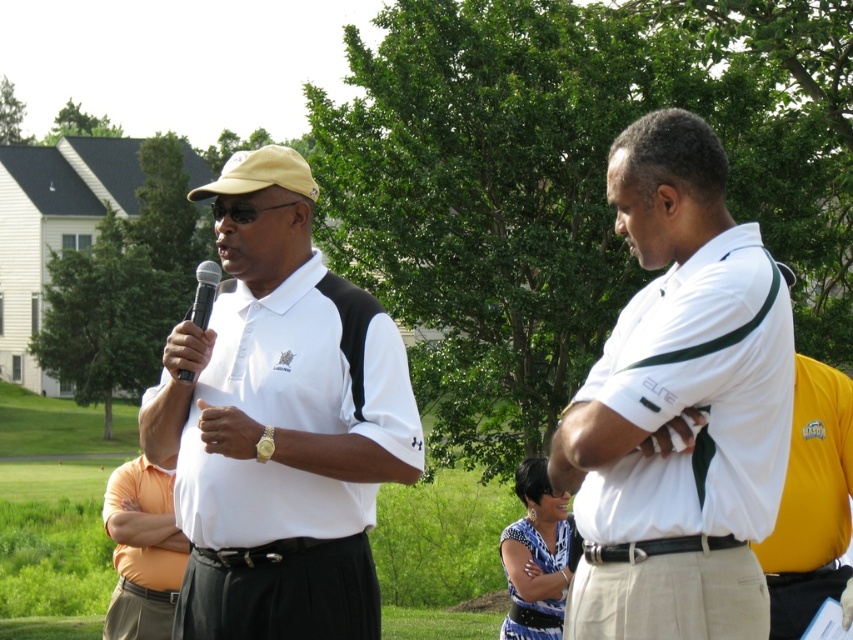
Question: Which object is closer to the camera taking this photo?

Choices:
 (A) white smooth shirt at center
 (B) orange cotton shirt at center
 (C) matte white polo shirt at center

Answer: (A)

Question: In this image, where is matte white polo shirt at center located relative to white smooth shirt at center?

Choices:
 (A) left
 (B) right

Answer: (A)

Question: Which is nearer to the matte white polo shirt at center?

Choices:
 (A) orange cotton shirt at center
 (B) white smooth shirt at center

Answer: (B)

Question: Can you confirm if white smooth shirt at center is positioned below orange cotton shirt at center?

Choices:
 (A) no
 (B) yes

Answer: (A)

Question: Does matte white polo shirt at center appear on the right side of white smooth shirt at center?

Choices:
 (A) yes
 (B) no

Answer: (B)

Question: Among these objects, which one is farthest from the camera?

Choices:
 (A) matte white polo shirt at center
 (B) white smooth shirt at center

Answer: (A)